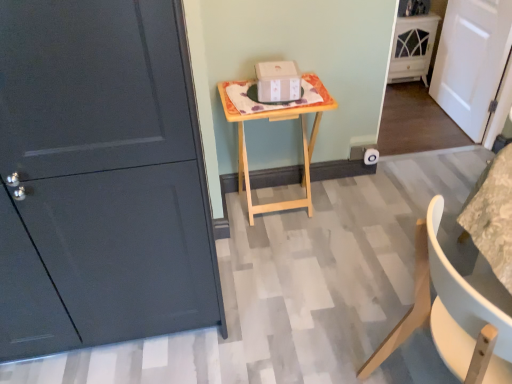
Question: Is white cardboard box at center taller than natural wood table at center?

Choices:
 (A) no
 (B) yes

Answer: (A)

Question: Could you tell me if white cardboard box at center is facing natural wood table at center?

Choices:
 (A) no
 (B) yes

Answer: (A)

Question: From a real-world perspective, does white cardboard box at center sit lower than natural wood table at center?

Choices:
 (A) no
 (B) yes

Answer: (A)

Question: Considering the relative sizes of white cardboard box at center and natural wood table at center in the image provided, is white cardboard box at center bigger than natural wood table at center?

Choices:
 (A) no
 (B) yes

Answer: (A)

Question: Does white cardboard box at center come behind natural wood table at center?

Choices:
 (A) no
 (B) yes

Answer: (B)

Question: From the image's perspective, is white matte door at right, the 1th door when ordered from right to left, positioned above or below natural wood table at center?

Choices:
 (A) below
 (B) above

Answer: (B)

Question: Is point (461, 62) closer or farther from the camera than point (242, 165)?

Choices:
 (A) closer
 (B) farther

Answer: (B)

Question: Considering the positions of white matte door at right, the second door when ordered from front to back, and natural wood table at center in the image, is white matte door at right, the second door when ordered from front to back, wider or thinner than natural wood table at center?

Choices:
 (A) wide
 (B) thin

Answer: (B)

Question: In terms of height, does white matte door at right, which ranks as the 1th door in back-to-front order, look taller or shorter compared to natural wood table at center?

Choices:
 (A) short
 (B) tall

Answer: (B)

Question: From the image's perspective, is white matte door at right, the 1th door when ordered from right to left, located above or below white matte chair at lower right?

Choices:
 (A) above
 (B) below

Answer: (A)

Question: Is white matte door at right, which ranks as the 1th door in back-to-front order, bigger or smaller than white matte chair at lower right?

Choices:
 (A) big
 (B) small

Answer: (B)

Question: From their relative heights in the image, would you say white matte door at right, which is the 2th door from left to right, is taller or shorter than white matte chair at lower right?

Choices:
 (A) tall
 (B) short

Answer: (A)

Question: Looking at their shapes, would you say white matte door at right, the second door when ordered from front to back, is wider or thinner than white matte chair at lower right?

Choices:
 (A) thin
 (B) wide

Answer: (A)

Question: Based on their positions, is white matte chair at lower right located to the left or right of white matte door at right, the 1th door when ordered from right to left?

Choices:
 (A) right
 (B) left

Answer: (B)

Question: Considering the positions of white matte chair at lower right and white matte door at right, which ranks as the 1th door in back-to-front order, in the image, is white matte chair at lower right wider or thinner than white matte door at right, which ranks as the 1th door in back-to-front order,?

Choices:
 (A) thin
 (B) wide

Answer: (B)